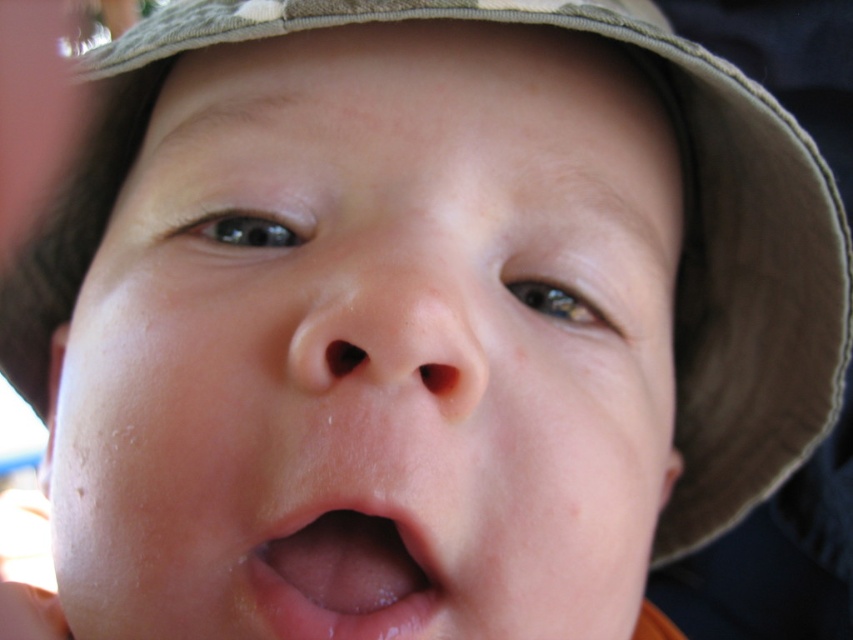
Who is positioned more to the right, smooth skin face at center or pink smooth lips at center?

pink smooth lips at center is more to the right.

Is point (88, 529) positioned in front of point (421, 561)?

No, (88, 529) is behind (421, 561).

Does point (389, 38) come behind point (363, 525)?

Yes, point (389, 38) is behind point (363, 525).

Locate an element on the screen. This screenshot has height=640, width=853. smooth skin face at center is located at coordinates (374, 346).